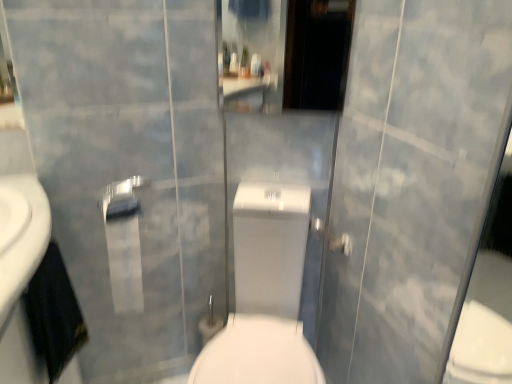
Question: Considering the relative sizes of silver metallic towel bar at upper center and white glossy toilet at center in the image provided, is silver metallic towel bar at upper center taller than white glossy toilet at center?

Choices:
 (A) yes
 (B) no

Answer: (B)

Question: Is silver metallic towel bar at upper center far away from white glossy toilet at center?

Choices:
 (A) no
 (B) yes

Answer: (A)

Question: Is silver metallic towel bar at upper center oriented away from white glossy toilet at center?

Choices:
 (A) yes
 (B) no

Answer: (B)

Question: Considering the relative sizes of silver metallic towel bar at upper center and white glossy toilet at center in the image provided, is silver metallic towel bar at upper center shorter than white glossy toilet at center?

Choices:
 (A) no
 (B) yes

Answer: (B)

Question: Is white glossy toilet at center completely or partially inside silver metallic towel bar at upper center?

Choices:
 (A) no
 (B) yes

Answer: (A)

Question: Is white glossy toilet at center inside the boundaries of silver metallic towel bar at upper center, or outside?

Choices:
 (A) outside
 (B) inside

Answer: (A)

Question: Considering the positions of point (266, 324) and point (145, 183), is point (266, 324) closer or farther from the camera than point (145, 183)?

Choices:
 (A) farther
 (B) closer

Answer: (A)

Question: In the image, is white glossy toilet at center positioned in front of or behind silver metallic towel bar at upper center?

Choices:
 (A) front
 (B) behind

Answer: (A)

Question: Is white glossy toilet at center wider or thinner than silver metallic towel bar at upper center?

Choices:
 (A) thin
 (B) wide

Answer: (B)

Question: Relative to matte silver shower at center, is white glossy toilet at center in front or behind?

Choices:
 (A) front
 (B) behind

Answer: (A)

Question: In the image, is white glossy toilet at center on the left side or the right side of matte silver shower at center?

Choices:
 (A) right
 (B) left

Answer: (B)

Question: In terms of height, does white glossy toilet at center look taller or shorter compared to matte silver shower at center?

Choices:
 (A) tall
 (B) short

Answer: (A)

Question: Is white glossy toilet at center bigger or smaller than matte silver shower at center?

Choices:
 (A) small
 (B) big

Answer: (B)

Question: Do you think silver metallic towel bar at upper center is within white glossy toilet at center, or outside of it?

Choices:
 (A) outside
 (B) inside

Answer: (A)

Question: Does point (114, 190) appear closer or farther from the camera than point (281, 248)?

Choices:
 (A) closer
 (B) farther

Answer: (A)